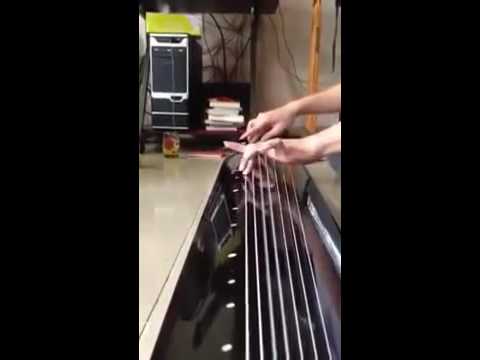
At what (x,y) coordinates should I click in order to perform the action: click on wires. Please return your answer as a coordinate pair (x, y). Looking at the image, I should click on (205, 42), (214, 49), (227, 61), (243, 56), (231, 22), (231, 29), (291, 55), (276, 43).